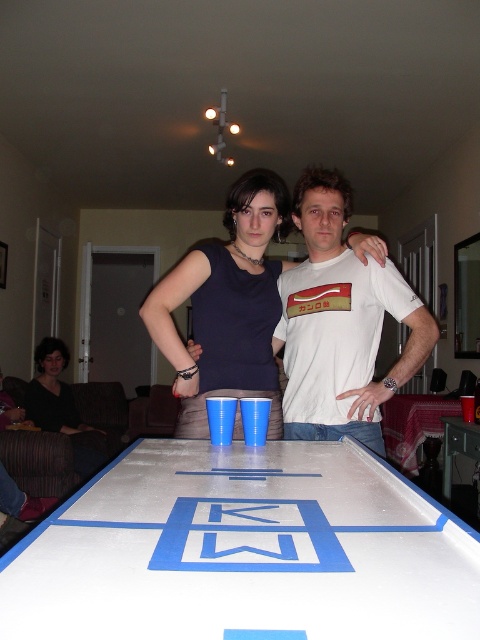
Question: Which point is closer to the camera taking this photo?

Choices:
 (A) (474, 440)
 (B) (268, 371)
 (C) (2, 573)

Answer: (C)

Question: Is white painted wood table at center to the left of white matte t-shirt at center from the viewer's perspective?

Choices:
 (A) no
 (B) yes

Answer: (B)

Question: Does white painted wood table at center appear under dark brown hair at lower left?

Choices:
 (A) yes
 (B) no

Answer: (B)

Question: Which is nearer to the matte blue tank top at center?

Choices:
 (A) white glossy table at center
 (B) dark brown hair at lower left

Answer: (A)

Question: Which point appears farthest from the camera in this image?

Choices:
 (A) (302, 637)
 (B) (260, 307)
 (C) (75, 470)
 (D) (309, 268)

Answer: (C)

Question: Observing the image, what is the correct spatial positioning of matte blue tank top at center in reference to white glossy table at center?

Choices:
 (A) right
 (B) left

Answer: (B)